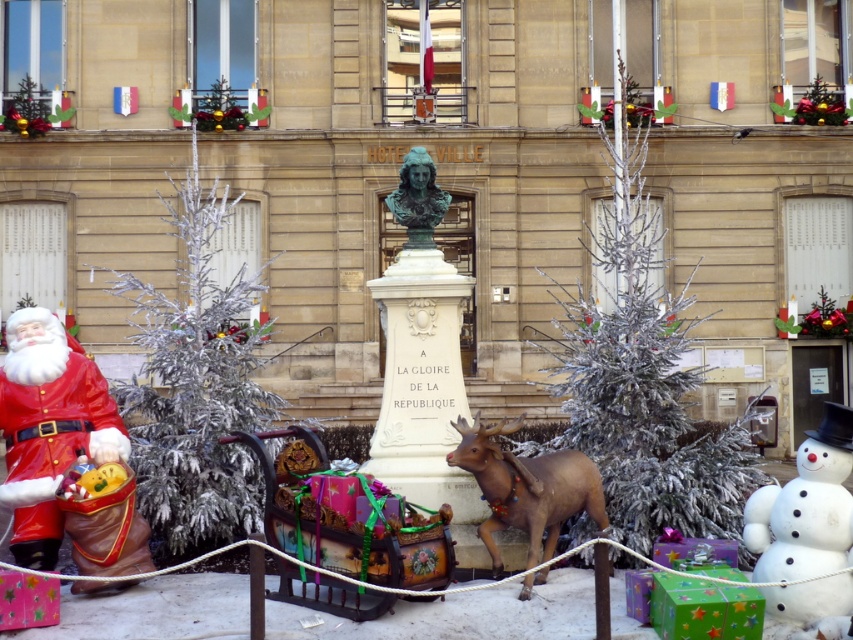
Question: Does silver metallic christmas tree at left come in front of brown matte/decorative reindeer at center?

Choices:
 (A) yes
 (B) no

Answer: (B)

Question: Can you confirm if frosted silver tree at center is positioned above brown matte/decorative reindeer at center?

Choices:
 (A) yes
 (B) no

Answer: (A)

Question: Is frosted silver tree at center bigger than shiny red santa at left?

Choices:
 (A) yes
 (B) no

Answer: (A)

Question: Among these points, which one is farthest from the camera?

Choices:
 (A) (845, 625)
 (B) (38, 326)

Answer: (B)

Question: Among these points, which one is farthest from the camera?

Choices:
 (A) (73, 352)
 (B) (740, 440)
 (C) (834, 449)
 (D) (494, 470)

Answer: (B)

Question: Which point is farther to the camera?

Choices:
 (A) (462, 444)
 (B) (263, 330)
 (C) (4, 408)

Answer: (B)